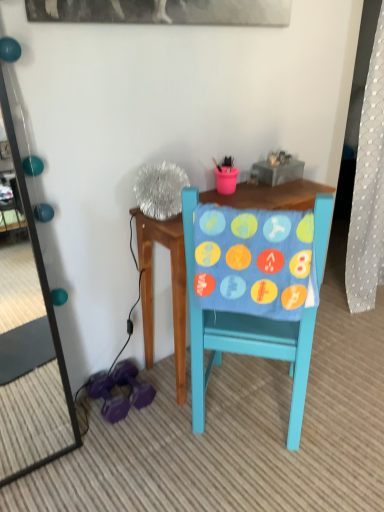
Question: Are blue fabric with colorful patches at center and teal glossy mirror at left far apart?

Choices:
 (A) yes
 (B) no

Answer: (B)

Question: From a real-world perspective, is blue fabric with colorful patches at center positioned under teal glossy mirror at left based on gravity?

Choices:
 (A) no
 (B) yes

Answer: (B)

Question: Can you confirm if blue fabric with colorful patches at center is taller than teal glossy mirror at left?

Choices:
 (A) no
 (B) yes

Answer: (A)

Question: Does blue fabric with colorful patches at center contain teal glossy mirror at left?

Choices:
 (A) yes
 (B) no

Answer: (B)

Question: Is blue fabric with colorful patches at center further to the viewer compared to teal glossy mirror at left?

Choices:
 (A) no
 (B) yes

Answer: (B)

Question: Is blue fabric with colorful patches at center facing away from teal glossy mirror at left?

Choices:
 (A) yes
 (B) no

Answer: (B)

Question: Is teal glossy mirror at left touching blue fabric with colorful patches at center?

Choices:
 (A) no
 (B) yes

Answer: (A)

Question: Can you confirm if teal glossy mirror at left is taller than blue fabric with colorful patches at center?

Choices:
 (A) no
 (B) yes

Answer: (B)

Question: Is teal glossy mirror at left not within blue fabric with colorful patches at center?

Choices:
 (A) yes
 (B) no

Answer: (A)

Question: From the image's perspective, is teal glossy mirror at left beneath blue fabric with colorful patches at center?

Choices:
 (A) no
 (B) yes

Answer: (A)

Question: Could you tell me if teal glossy mirror at left is turned towards blue fabric with colorful patches at center?

Choices:
 (A) no
 (B) yes

Answer: (A)

Question: From a real-world perspective, is teal glossy mirror at left over blue fabric with colorful patches at center?

Choices:
 (A) yes
 (B) no

Answer: (A)

Question: From a real-world perspective, is matte blue chair at center located beneath teal glossy mirror at left?

Choices:
 (A) yes
 (B) no

Answer: (A)